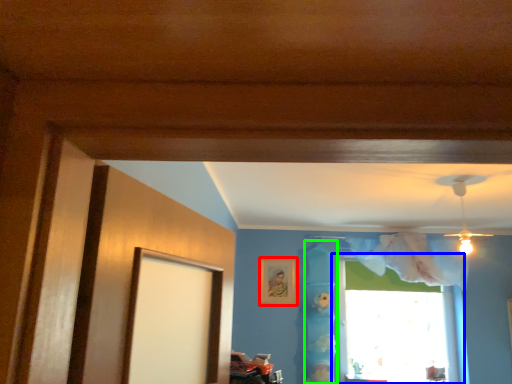
Question: Based on their relative distances, which object is farther from picture frame (highlighted by a red box)? Choose from window (highlighted by a blue box) and curtain (highlighted by a green box).

Choices:
 (A) window
 (B) curtain

Answer: (A)